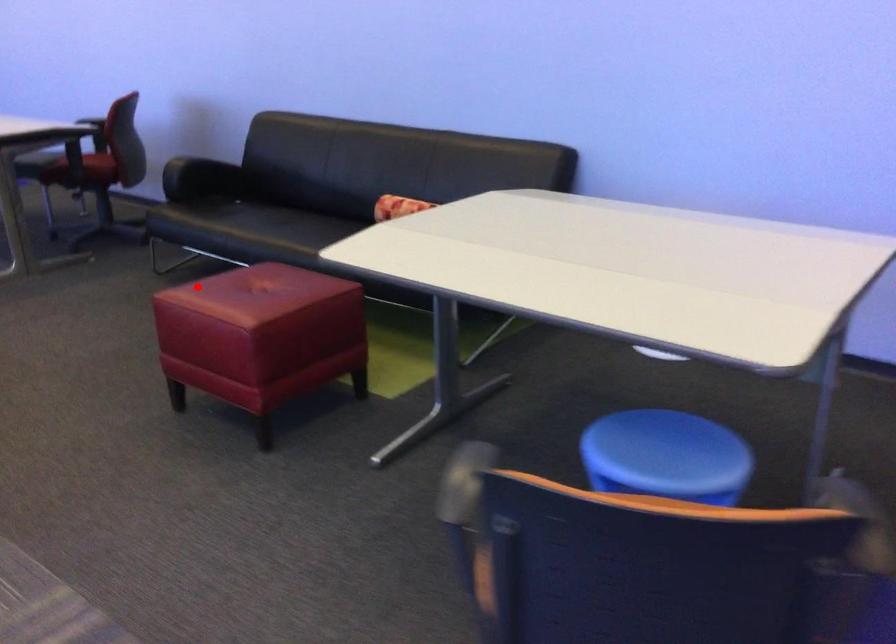
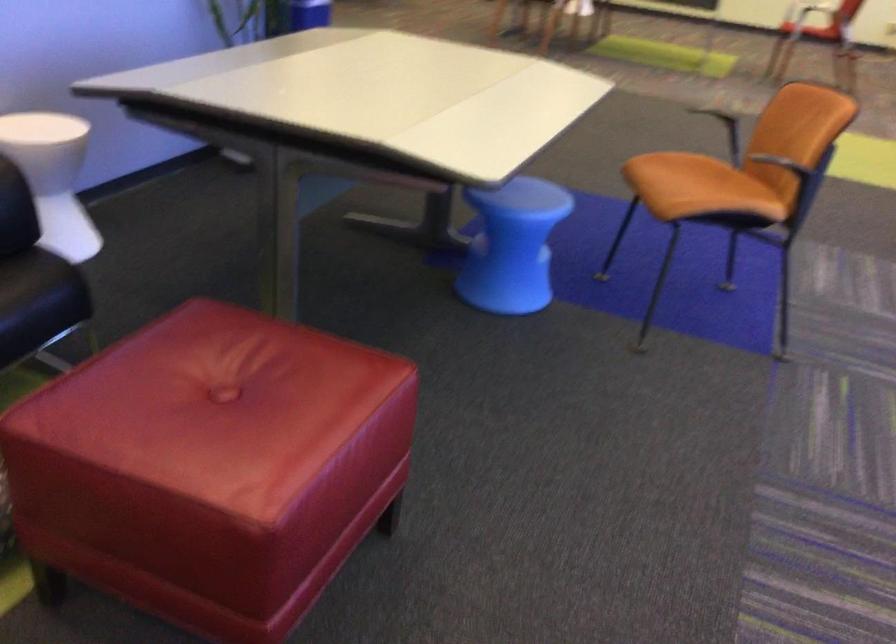
Question: I am providing you with two images of the same scene from different viewpoints. In image1, a red point is highlighted. Considering the same 3D point in image2, which of the following is correct?

Choices:
 (A) It is closer
 (B) It is farther

Answer: (A)